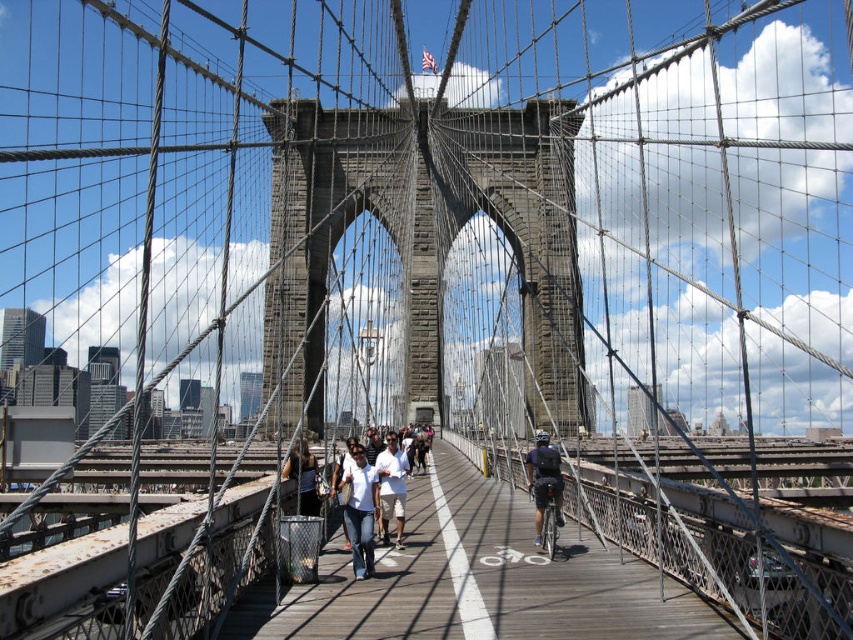
Is denim pants at center shorter than dark blue jeans at center?

Incorrect, denim pants at center's height does not fall short of dark blue jeans at center's.

Who is taller, denim pants at center or dark blue jeans at center?

With more height is denim pants at center.

You are a GUI agent. You are given a task and a screenshot of the screen. Output one action in this format:
    pyautogui.click(x=<x>, y=<y>)
    Task: Click on the denim pants at center
    
    Given the screenshot: What is the action you would take?
    pyautogui.click(x=360, y=509)

Find the location of a particular element. The height and width of the screenshot is (640, 853). denim pants at center is located at coordinates 360,509.

Does point (560, 477) come in front of point (381, 476)?

That is True.

Describe the element at coordinates (544, 481) in the screenshot. The image size is (853, 640). I see `dark blue jeans at center` at that location.

Where is `dark blue jeans at center`? dark blue jeans at center is located at coordinates (544, 481).

Can you confirm if wooden walkway at center is positioned above white cotton shirt at center?

Actually, wooden walkway at center is below white cotton shirt at center.

Between point (654, 634) and point (396, 477), which one is positioned in front?

Positioned in front is point (654, 634).

Find the location of a particular element. The height and width of the screenshot is (640, 853). wooden walkway at center is located at coordinates (479, 579).